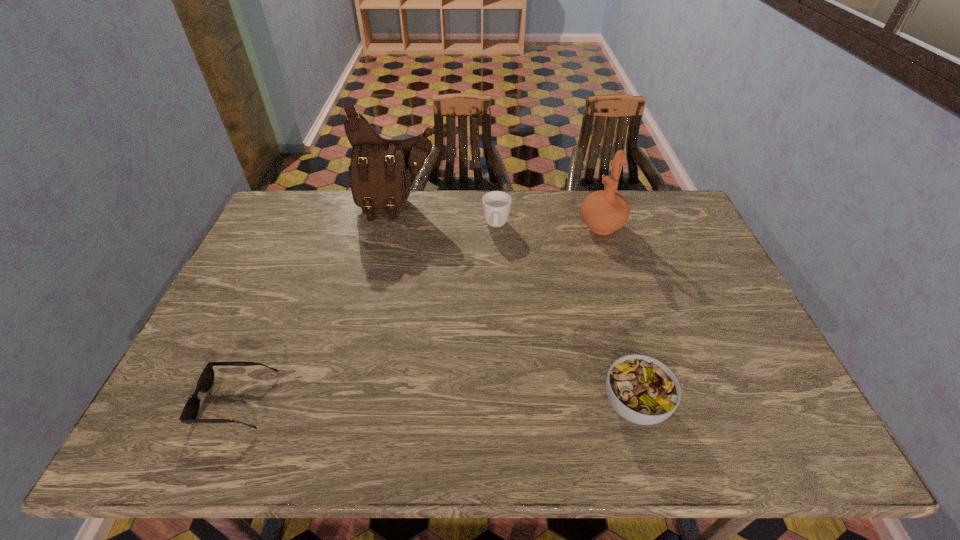
Locate an element on the screen. The height and width of the screenshot is (540, 960). empty space that is in between the shortest object and the tallest object is located at coordinates (317, 303).

Identify the location of vacant space that's between the pottery and the leftmost object. The image size is (960, 540). (419, 314).

You are a GUI agent. You are given a task and a screenshot of the screen. Output one action in this format:
    pyautogui.click(x=<x>, y=<y>)
    Task: Click on the unoccupied area between the tallest object and the leftmost object
    This screenshot has height=540, width=960.
    Given the screenshot: What is the action you would take?
    pyautogui.click(x=317, y=303)

Find the location of `vacant space that's between the cup and the tallest object`. vacant space that's between the cup and the tallest object is located at coordinates (447, 217).

What are the coordinates of `unoccupied area between the soup bowl and the second tallest object` in the screenshot? It's located at (618, 315).

The image size is (960, 540). Find the location of `vacant area that lies between the sunglasses and the second tallest object`. vacant area that lies between the sunglasses and the second tallest object is located at coordinates (419, 314).

I want to click on empty space that is in between the shoulder bag and the cup, so point(447,217).

At what (x,y) coordinates should I click in order to perform the action: click on vacant area that lies between the cup and the leftmost object. Please return your answer as a coordinate pair (x, y). The height and width of the screenshot is (540, 960). Looking at the image, I should click on (366, 314).

Locate an element on the screen. This screenshot has height=540, width=960. vacant point located between the cup and the tallest object is located at coordinates (447, 217).

Identify which object is located as the fourth nearest to the fourth shortest object. Please provide its 2D coordinates. Your answer should be formatted as a tuple, i.e. [(x, y)], where the tuple contains the x and y coordinates of a point satisfying the conditions above.

[(191, 409)]